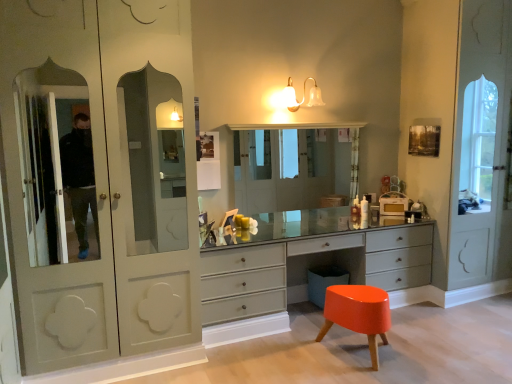
Question: From the image's perspective, is clear glass medicine cabinet at center located above or below satin gray dresser at center?

Choices:
 (A) below
 (B) above

Answer: (B)

Question: Is clear glass medicine cabinet at center taller or shorter than satin gray dresser at center?

Choices:
 (A) tall
 (B) short

Answer: (A)

Question: Which object is the closest to the translucent glass sconce at upper center?

Choices:
 (A) orange glossy stool at lower right
 (B) clear glass medicine cabinet at center
 (C) matte white wardrobe at left
 (D) satin gray dresser at center

Answer: (D)

Question: Which object is positioned closest to the orange glossy stool at lower right?

Choices:
 (A) clear glass medicine cabinet at center
 (B) satin gray dresser at center
 (C) matte white wardrobe at left
 (D) translucent glass sconce at upper center

Answer: (B)